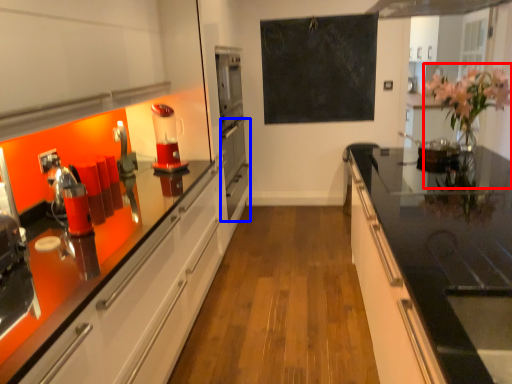
Question: Among these objects, which one is nearest to the camera, floral arrangement (highlighted by a red box) or oven (highlighted by a blue box)?

Choices:
 (A) floral arrangement
 (B) oven

Answer: (A)